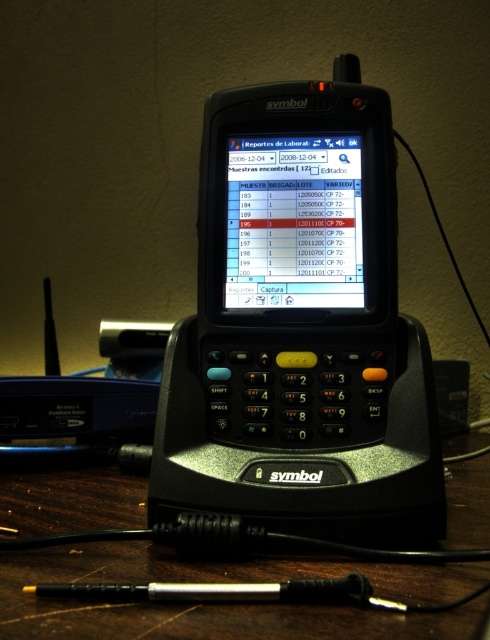
Can you confirm if black plastic phone at center is taller than black plastic table at center?

Yes.

Is black plastic phone at center positioned behind black plastic table at center?

Yes, it is behind black plastic table at center.

Describe the element at coordinates (299, 328) in the screenshot. I see `black plastic phone at center` at that location.

You are a GUI agent. You are given a task and a screenshot of the screen. Output one action in this format:
    pyautogui.click(x=<x>, y=<y>)
    Task: Click on the black plastic phone at center
    The height and width of the screenshot is (640, 490).
    Given the screenshot: What is the action you would take?
    pyautogui.click(x=299, y=328)